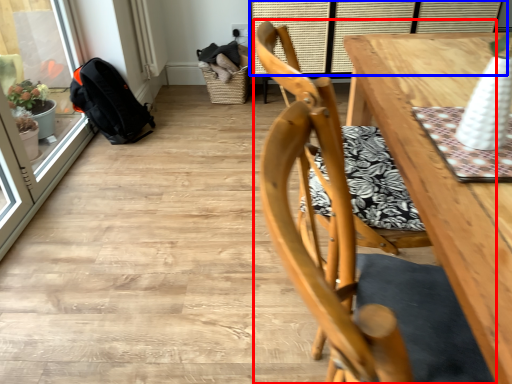
Question: Which object is further to the camera taking this photo, chair (highlighted by a red box) or window (highlighted by a blue box)?

Choices:
 (A) chair
 (B) window

Answer: (B)